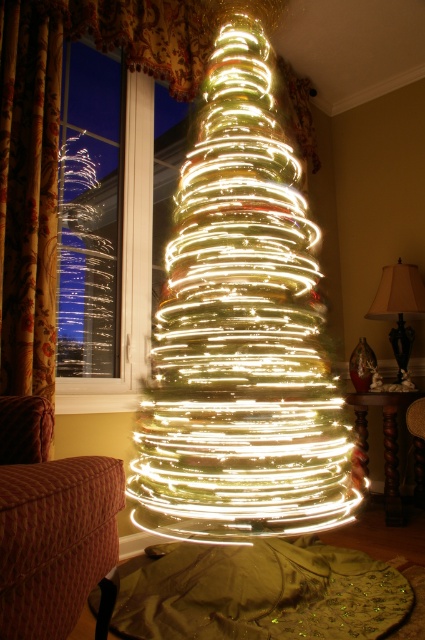
Between illuminated wire at center and transparent glass window at upper left, which one appears on the right side from the viewer's perspective?

illuminated wire at center is more to the right.

Which is in front, point (200, 326) or point (107, 157)?

Point (200, 326)

Where is `illuminated wire at center`? illuminated wire at center is located at coordinates pos(240,326).